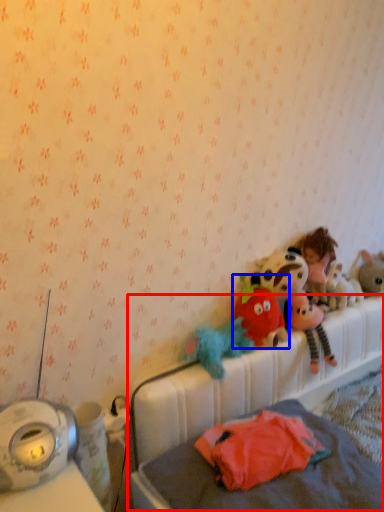
Question: Which of the following is the closest to the observer, hospital bed (highlighted by a red box) or toy (highlighted by a blue box)?

Choices:
 (A) hospital bed
 (B) toy

Answer: (A)